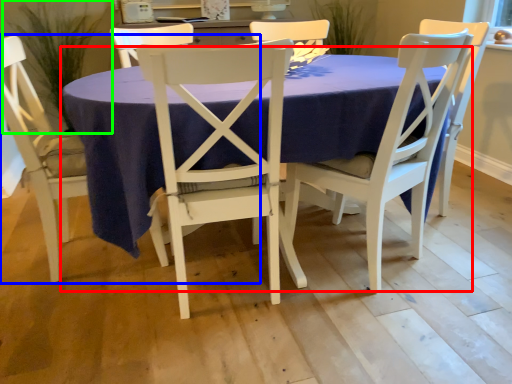
Question: Estimate the real-world distances between objects in this image. Which object is farther from kitchen & dining room table (highlighted by a red box), chair (highlighted by a blue box) or plant (highlighted by a green box)?

Choices:
 (A) chair
 (B) plant

Answer: (B)